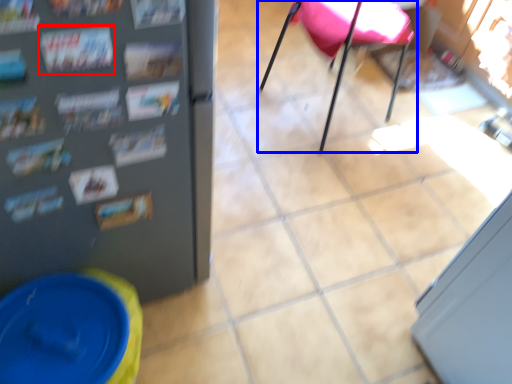
Question: Which object appears farthest to the camera in this image, magazine (highlighted by a red box) or chair (highlighted by a blue box)?

Choices:
 (A) magazine
 (B) chair

Answer: (B)